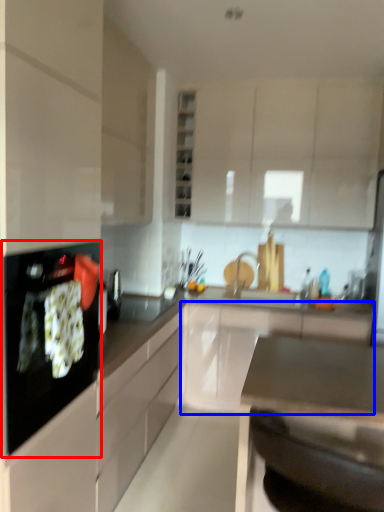
Question: Which object appears closest to the camera in this image, kitchen appliance (highlighted by a red box) or cabinetry (highlighted by a blue box)?

Choices:
 (A) kitchen appliance
 (B) cabinetry

Answer: (A)